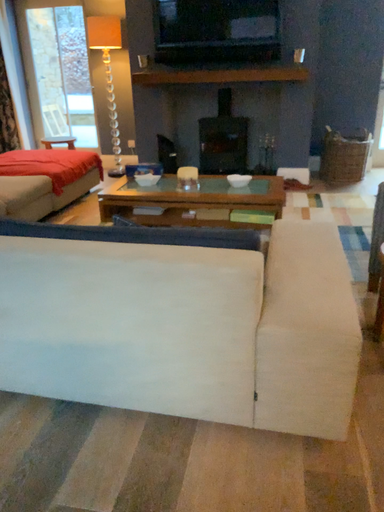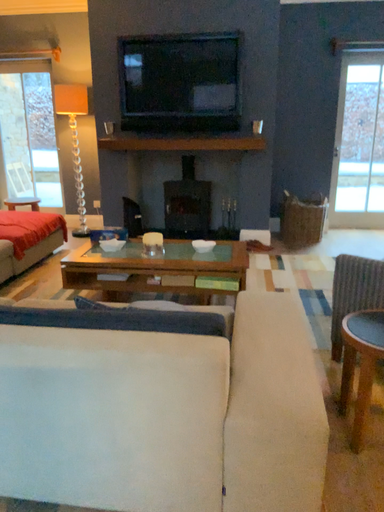
Question: How did the camera likely rotate when shooting the video?

Choices:
 (A) rotated downward
 (B) rotated upward

Answer: (B)